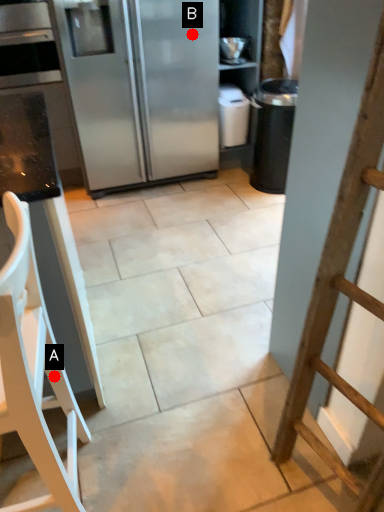
Question: Two points are circled on the image, labeled by A and B beside each circle. Which point is closer to the camera taking this photo?

Choices:
 (A) A is closer
 (B) B is closer

Answer: (A)